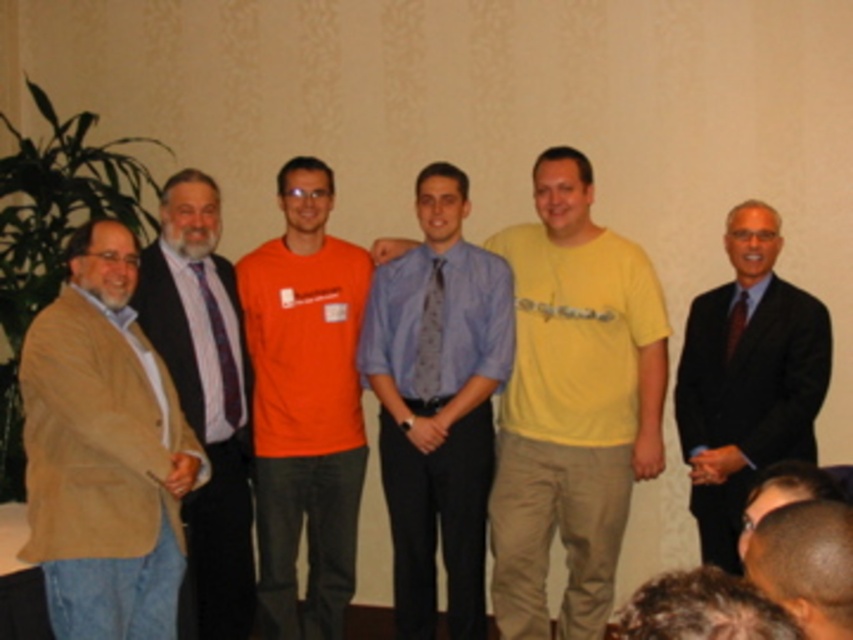
Question: Which is farther from the yellow cotton t-shirt at center?

Choices:
 (A) orange t-shirt at center
 (B) beige corduroy blazer at left

Answer: (B)

Question: Is blue shirt with tie at center further to camera compared to orange t-shirt at center?

Choices:
 (A) yes
 (B) no

Answer: (B)

Question: Can you confirm if yellow cotton t-shirt at center is positioned to the left of dark blue suit at center?

Choices:
 (A) no
 (B) yes

Answer: (B)

Question: Estimate the real-world distances between objects in this image. Which object is farther from the patterned fabric tie at center?

Choices:
 (A) orange t-shirt at center
 (B) shiny black hair at lower right

Answer: (B)

Question: Among these points, which one is farthest from the camera?

Choices:
 (A) [x=230, y=384]
 (B) [x=442, y=294]
 (C) [x=511, y=477]

Answer: (B)

Question: Can you confirm if orange t-shirt at center is positioned to the right of black silk tie at center?

Choices:
 (A) no
 (B) yes

Answer: (A)